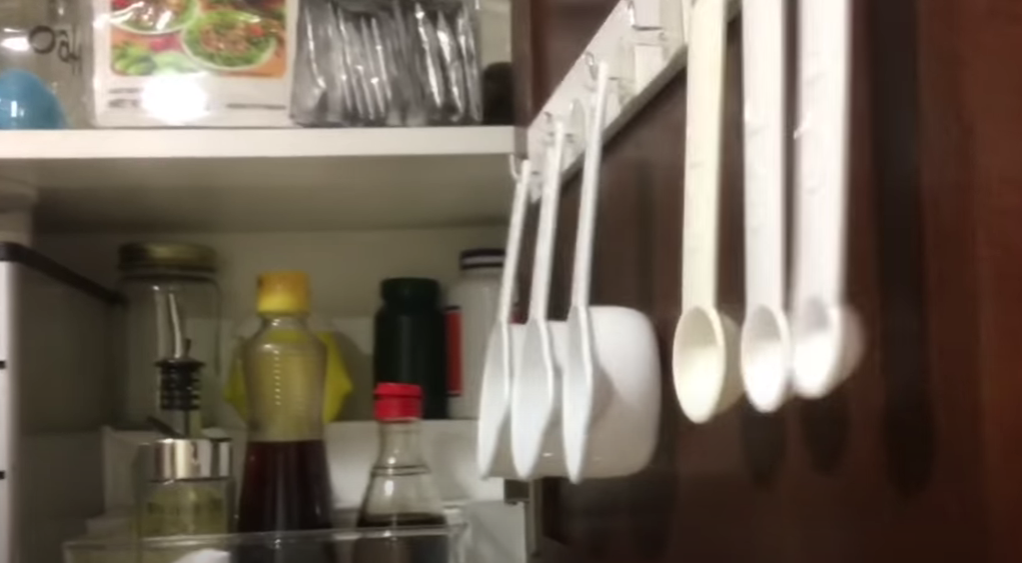
Locate an element on the screen. Image resolution: width=1022 pixels, height=563 pixels. white horizontal hook rack is located at coordinates (639, 64).